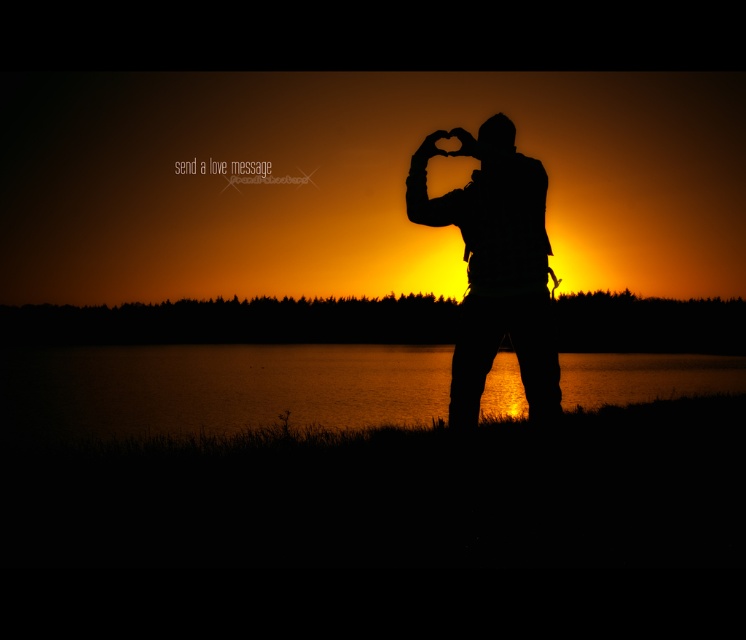
You are a photographer trying to capture the silhouette figure at center and the glistening water at center. Based on their positions, can you determine which object is closer to the camera?

The glistening water at center is positioned under the silhouette figure at center, meaning the silhouette figure at center is closer to the camera than the glistening water at center.